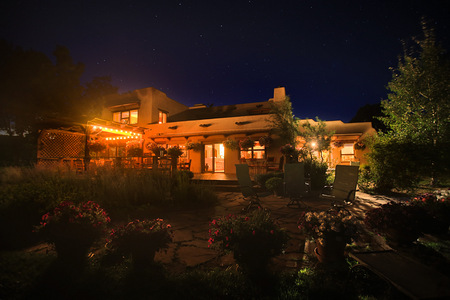
You are a GUI agent. You are given a task and a screenshot of the screen. Output one action in this format:
    pyautogui.click(x=<x>, y=<y>)
    Task: Click on the window
    The height and width of the screenshot is (300, 450).
    Given the screenshot: What is the action you would take?
    pyautogui.click(x=348, y=150)